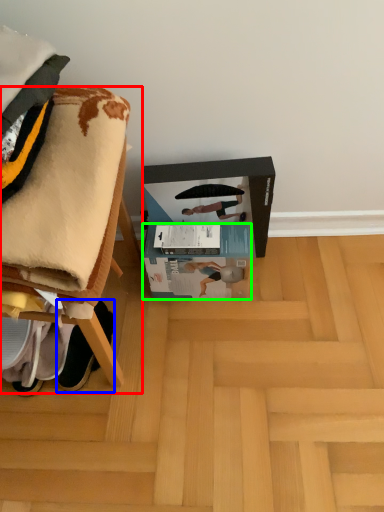
Question: Considering the real-world distances, which object is farthest from furniture (highlighted by a red box)? footwear (highlighted by a blue box) or box (highlighted by a green box)?

Choices:
 (A) footwear
 (B) box

Answer: (B)